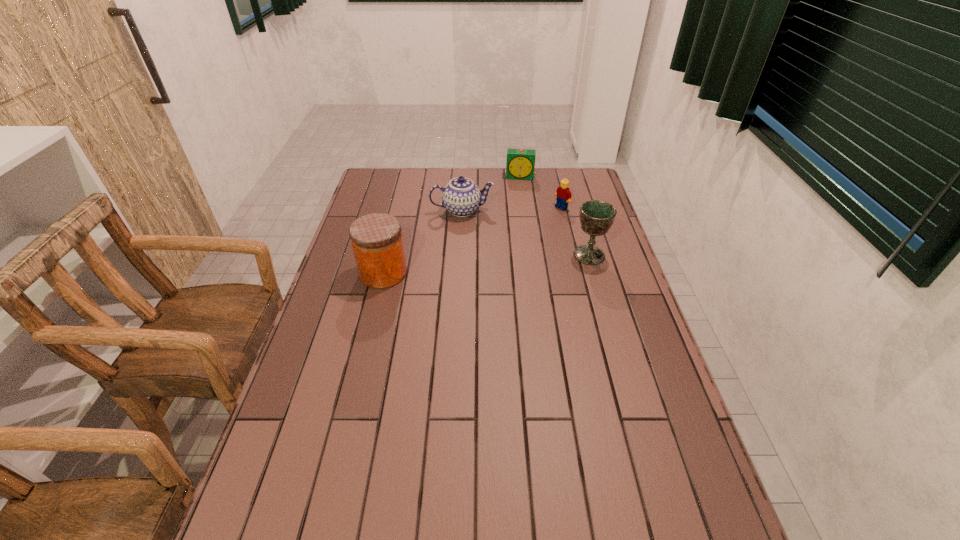
Image resolution: width=960 pixels, height=540 pixels. In order to click on chalice present at the right edge in this screenshot , I will do `click(596, 217)`.

This screenshot has height=540, width=960. Identify the location of Lego that is at the right edge. (563, 194).

In the image, there is a desktop. Identify the location of vacant space at the far edge. This screenshot has height=540, width=960. (450, 171).

Identify the location of vacant space at the left edge of the desktop. (341, 449).

Find the location of `vacant space at the right edge`. vacant space at the right edge is located at coordinates (612, 316).

You are a GUI agent. You are given a task and a screenshot of the screen. Output one action in this format:
    pyautogui.click(x=<x>, y=<y>)
    Task: Click on the free space at the far left corner of the desktop
    
    Given the screenshot: What is the action you would take?
    pyautogui.click(x=375, y=179)

Identify the location of vacant space that is in between the second object from left to right and the leftmost object. (422, 242).

Identify the location of free space between the third object from right to left and the jar. Image resolution: width=960 pixels, height=540 pixels. (452, 225).

Identify the location of empty space that is in between the chalice and the jar. The width and height of the screenshot is (960, 540). (487, 264).

Find the location of a particular element. free space between the leftmost object and the third shortest object is located at coordinates (422, 242).